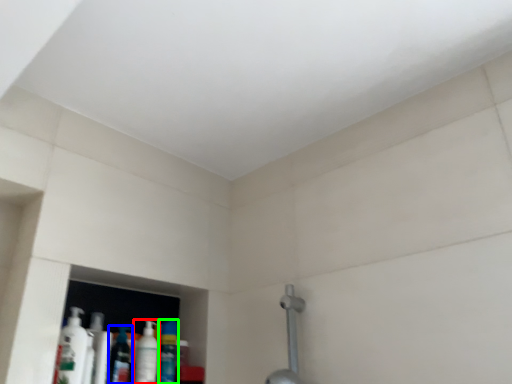
Question: Which object is positioned closest to mouthwash (highlighted by a red box)? Select from mouthwash (highlighted by a blue box) and mouthwash (highlighted by a green box).

Choices:
 (A) mouthwash
 (B) mouthwash

Answer: (A)